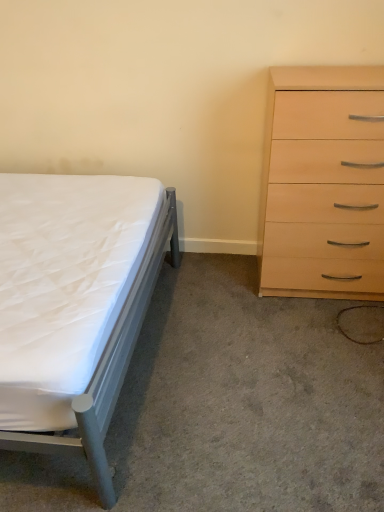
Locate an element on the screen. The image size is (384, 512). free point above white fabric bed at left (from a real-world perspective) is located at coordinates (243, 374).